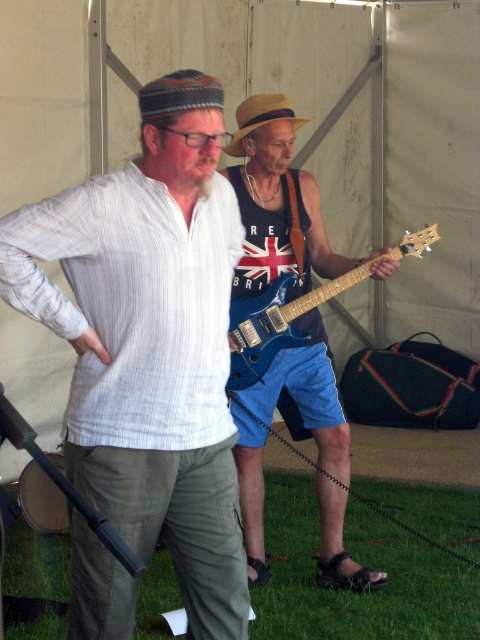
Is blue glossy electric guitar at center to the left of glossy electric guitar at center from the viewer's perspective?

Yes, blue glossy electric guitar at center is to the left of glossy electric guitar at center.

From the picture: How far apart are blue glossy electric guitar at center and glossy electric guitar at center?

A distance of 12.16 inches exists between blue glossy electric guitar at center and glossy electric guitar at center.

Locate an element on the screen. The image size is (480, 640). blue glossy electric guitar at center is located at coordinates (276, 202).

You are a GUI agent. You are given a task and a screenshot of the screen. Output one action in this format:
    pyautogui.click(x=<x>, y=<y>)
    Task: Click on the blue glossy electric guitar at center
    The height and width of the screenshot is (640, 480).
    Given the screenshot: What is the action you would take?
    pyautogui.click(x=276, y=202)

Who is shorter, glossy electric guitar at center or brown straw cowboy hat at center?

Standing shorter between the two is brown straw cowboy hat at center.

Can you confirm if glossy electric guitar at center is wider than brown straw cowboy hat at center?

Correct, the width of glossy electric guitar at center exceeds that of brown straw cowboy hat at center.

Does point (273, 339) come farther from viewer compared to point (244, 131)?

No, (273, 339) is in front of (244, 131).

Where is `glossy electric guitar at center`? The width and height of the screenshot is (480, 640). glossy electric guitar at center is located at coordinates (276, 323).

Between matte white shirt at center and glossy electric guitar at center, which one has less height?

glossy electric guitar at center is shorter.

Is matte white shirt at center thinner than glossy electric guitar at center?

Correct, matte white shirt at center's width is less than glossy electric guitar at center's.

Does point (84, 570) come in front of point (239, 308)?

Yes, point (84, 570) is in front of point (239, 308).

Where is `matte white shirt at center`? The width and height of the screenshot is (480, 640). matte white shirt at center is located at coordinates (149, 340).